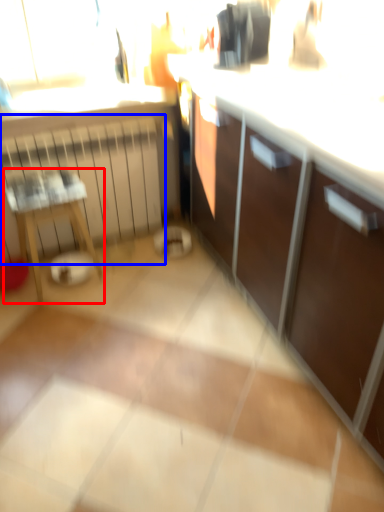
Question: Which point is closer to the camera, furniture (highlighted by a red box) or radiator (highlighted by a blue box)?

Choices:
 (A) furniture
 (B) radiator

Answer: (A)